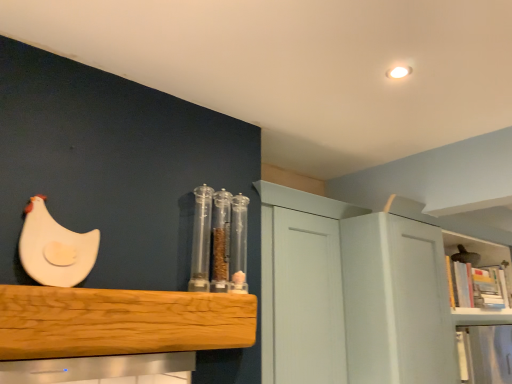
Question: Is transparent plastic containers at center at the right side of white matte chicken at left, which is the 1th chicken in left-to-right order?

Choices:
 (A) yes
 (B) no

Answer: (A)

Question: Could you tell me if transparent plastic containers at center is facing white matte chicken at left, placed as the 2th chicken when sorted from right to left?

Choices:
 (A) yes
 (B) no

Answer: (B)

Question: Is the position of transparent plastic containers at center less distant than that of white matte chicken at left, the 1th chicken from the top?

Choices:
 (A) no
 (B) yes

Answer: (A)

Question: Can you see transparent plastic containers at center touching white matte chicken at left, marked as the 2th chicken in a bottom-to-top arrangement?

Choices:
 (A) yes
 (B) no

Answer: (B)

Question: From the image's perspective, would you say transparent plastic containers at center is positioned over white matte chicken at left, placed as the 2th chicken when sorted from right to left?

Choices:
 (A) no
 (B) yes

Answer: (A)

Question: Considering the positions of wooden bookshelf at upper right, the 1th shelf positioned from the right, and natural wood shelf at center, the first shelf in the front-to-back sequence, in the image, is wooden bookshelf at upper right, the 1th shelf positioned from the right, bigger or smaller than natural wood shelf at center, the first shelf in the front-to-back sequence,?

Choices:
 (A) big
 (B) small

Answer: (A)

Question: Relative to natural wood shelf at center, which ranks as the 1th shelf in left-to-right order, is wooden bookshelf at upper right, the 1th shelf positioned from the right, in front or behind?

Choices:
 (A) behind
 (B) front

Answer: (A)

Question: From the image's perspective, is wooden bookshelf at upper right, the 2th shelf viewed from the front, located above or below natural wood shelf at center, which ranks as the second shelf in back-to-front order?

Choices:
 (A) below
 (B) above

Answer: (A)

Question: In terms of width, does wooden bookshelf at upper right, which ranks as the 2th shelf in left-to-right order, look wider or thinner when compared to natural wood shelf at center, arranged as the 2th shelf when viewed from the right?

Choices:
 (A) wide
 (B) thin

Answer: (A)

Question: Is white matte chicken at upper left, acting as the first chicken starting from the bottom, in front of or behind transparent plastic containers at center in the image?

Choices:
 (A) behind
 (B) front

Answer: (A)

Question: From the image's perspective, relative to transparent plastic containers at center, is white matte chicken at upper left, marked as the second chicken in a front-to-back arrangement, above or below?

Choices:
 (A) above
 (B) below

Answer: (B)

Question: Looking at the image, does white matte chicken at upper left, the 1th chicken in the right-to-left sequence, seem bigger or smaller compared to transparent plastic containers at center?

Choices:
 (A) big
 (B) small

Answer: (B)

Question: In terms of width, does white matte chicken at upper left, which is the second chicken in left-to-right order, look wider or thinner when compared to transparent plastic containers at center?

Choices:
 (A) wide
 (B) thin

Answer: (A)

Question: Considering the positions of point (485, 253) and point (230, 263), is point (485, 253) closer or farther from the camera than point (230, 263)?

Choices:
 (A) closer
 (B) farther

Answer: (B)

Question: Relative to transparent plastic containers at center, is wooden bookshelf at upper right, which ranks as the 2th shelf in left-to-right order, in front or behind?

Choices:
 (A) front
 (B) behind

Answer: (B)